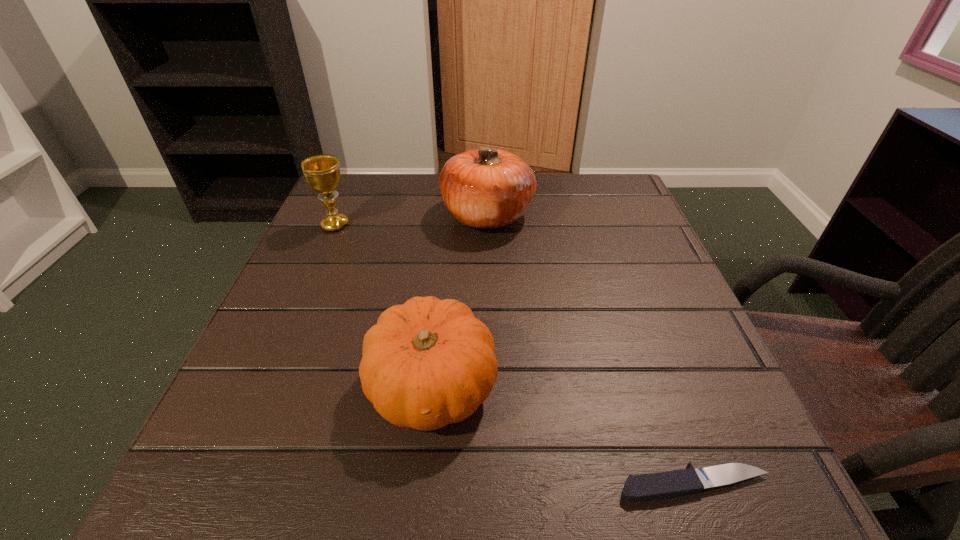
Identify the location of pumpkin situated at the far edge. The width and height of the screenshot is (960, 540). (487, 188).

I want to click on chalice that is at the far edge, so click(x=322, y=174).

Locate an element on the screen. This screenshot has height=540, width=960. pumpkin present at the near edge is located at coordinates (427, 363).

Where is `steak knife located in the near edge section of the desktop`? steak knife located in the near edge section of the desktop is located at coordinates (663, 485).

Image resolution: width=960 pixels, height=540 pixels. Find the location of `object located at the left edge`. object located at the left edge is located at coordinates (322, 174).

At what (x,y) coordinates should I click in order to perform the action: click on object that is at the right edge. Please return your answer as a coordinate pair (x, y). The image size is (960, 540). Looking at the image, I should click on (663, 485).

At what (x,y) coordinates should I click in order to perform the action: click on object that is at the far left corner. Please return your answer as a coordinate pair (x, y). Image resolution: width=960 pixels, height=540 pixels. Looking at the image, I should click on (322, 174).

The height and width of the screenshot is (540, 960). Find the location of `object situated at the near right corner`. object situated at the near right corner is located at coordinates (x=663, y=485).

This screenshot has height=540, width=960. I want to click on vacant position at the far edge of the desktop, so click(528, 217).

The image size is (960, 540). What are the coordinates of `free space at the near edge of the desktop` in the screenshot? It's located at (316, 462).